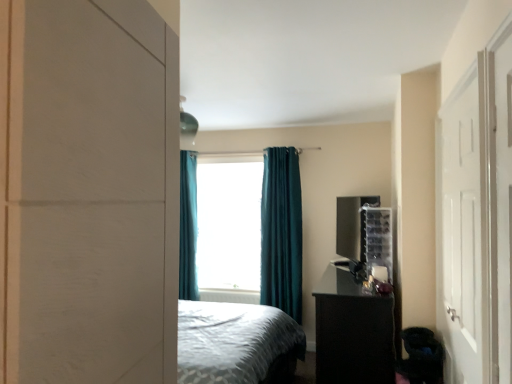
Image resolution: width=512 pixels, height=384 pixels. Describe the element at coordinates (353, 331) in the screenshot. I see `black glossy nightstand at lower right` at that location.

What do you see at coordinates (463, 229) in the screenshot?
I see `white matte door at right` at bounding box center [463, 229].

This screenshot has width=512, height=384. In order to click on teal fabric curtain at center, placed as the first curtain when sorted from front to back in this screenshot , I will do `click(281, 232)`.

What is the approximate width of clear plastic organizer at right?

It is 29.12 centimeters.

The height and width of the screenshot is (384, 512). Describe the element at coordinates (229, 223) in the screenshot. I see `teal curtain at center` at that location.

The image size is (512, 384). I want to click on teal fabric curtain at left, the 1th curtain viewed from the back, so click(x=188, y=226).

At what (x,y) coordinates should I click in order to perform the action: click on black glossy nightstand at lower right. Please return your answer as a coordinate pair (x, y). The height and width of the screenshot is (384, 512). Looking at the image, I should click on (353, 331).

This screenshot has height=384, width=512. Identify the location of nightstand above the white plastic radiator at center (from the image's perspective). point(353,331).

From a real-world perspective, which object stands above the other?

white plastic radiator at center is physically above.

From the picture: From the image's perspective, who appears lower, black glossy nightstand at lower right or white plastic radiator at center?

white plastic radiator at center appears lower in the image.

Consider the image. Is black glossy nightstand at lower right next to white plastic radiator at center and touching it?

No.

From a real-world perspective, which object stands above the other?

white plastic radiator at center, from a real-world perspective.

Consider the image. Considering the relative sizes of white plastic radiator at center and black glossy nightstand at lower right in the image provided, is white plastic radiator at center wider than black glossy nightstand at lower right?

No.

Which is more to the left, white plastic radiator at center or black glossy nightstand at lower right?

Positioned to the left is white plastic radiator at center.

Which of these two, white plastic radiator at center or black glossy nightstand at lower right, is smaller?

white plastic radiator at center.

Considering the sizes of teal fabric curtain at left, the 1th curtain viewed from the back, and white matte door at right in the image, is teal fabric curtain at left, the 1th curtain viewed from the back, wider or thinner than white matte door at right?

Considering their sizes, teal fabric curtain at left, the 1th curtain viewed from the back, looks broader than white matte door at right.

Is teal fabric curtain at left, positioned as the second curtain in right-to-left order, shorter than white matte door at right?

No, teal fabric curtain at left, positioned as the second curtain in right-to-left order, is not shorter than white matte door at right.

Could you tell me if teal fabric curtain at left, the 1th curtain viewed from the back, is turned towards white matte door at right?

No, teal fabric curtain at left, the 1th curtain viewed from the back, does not turn towards white matte door at right.

Is teal fabric curtain at center, placed as the first curtain when sorted from front to back, wider than teal fabric curtain at left, which ranks as the first curtain in left-to-right order?

Yes.

Considering the relative positions of teal fabric curtain at center, the second curtain when ordered from back to front, and teal fabric curtain at left, positioned as the second curtain in right-to-left order, in the image provided, is teal fabric curtain at center, the second curtain when ordered from back to front, to the right of teal fabric curtain at left, positioned as the second curtain in right-to-left order, from the viewer's perspective?

Yes, teal fabric curtain at center, the second curtain when ordered from back to front, is to the right of teal fabric curtain at left, positioned as the second curtain in right-to-left order.

Is teal fabric curtain at center, arranged as the 2th curtain when viewed from the left, smaller than teal fabric curtain at left, the 2th curtain when ordered from front to back?

Actually, teal fabric curtain at center, arranged as the 2th curtain when viewed from the left, might be larger than teal fabric curtain at left, the 2th curtain when ordered from front to back.

From a real-world perspective, is teal fabric curtain at center, placed as the first curtain when sorted from front to back, below teal fabric curtain at left, the 2th curtain when ordered from front to back?

Yes, from a real-world perspective, teal fabric curtain at center, placed as the first curtain when sorted from front to back, is beneath teal fabric curtain at left, the 2th curtain when ordered from front to back.

How far apart are white plastic radiator at center and teal fabric curtain at left, positioned as the second curtain in right-to-left order?

The distance of white plastic radiator at center from teal fabric curtain at left, positioned as the second curtain in right-to-left order, is 23.90 inches.

Are white plastic radiator at center and teal fabric curtain at left, which ranks as the first curtain in left-to-right order, located far from each other?

No, there isn't a large distance between white plastic radiator at center and teal fabric curtain at left, which ranks as the first curtain in left-to-right order.

Which is more to the right, white plastic radiator at center or teal fabric curtain at left, positioned as the second curtain in right-to-left order?

white plastic radiator at center.

What's the angular difference between white plastic radiator at center and teal fabric curtain at left, the 2th curtain when ordered from front to back,'s facing directions?

2.64 degrees separate the facing orientations of white plastic radiator at center and teal fabric curtain at left, the 2th curtain when ordered from front to back.

From the image's perspective, which is above, white matte door at right or clear plastic organizer at right?

white matte door at right is shown above in the image.

Considering the relative sizes of white matte door at right and clear plastic organizer at right in the image provided, is white matte door at right thinner than clear plastic organizer at right?

Yes, white matte door at right is thinner than clear plastic organizer at right.

Is white matte door at right bigger than clear plastic organizer at right?

Yes, white matte door at right is bigger than clear plastic organizer at right.

Is point (210, 297) positioned in front of point (373, 249)?

No, it is not.

Is white plastic radiator at center inside the boundaries of clear plastic organizer at right, or outside?

white plastic radiator at center is spatially situated outside clear plastic organizer at right.

What's the angular difference between white plastic radiator at center and clear plastic organizer at right's facing directions?

There is a 88.2-degree angle between the facing directions of white plastic radiator at center and clear plastic organizer at right.

At what (x,y) coordinates should I click in order to perform the action: click on radiator lying below the black glossy nightstand at lower right (from the image's perspective). Please return your answer as a coordinate pair (x, y). Image resolution: width=512 pixels, height=384 pixels. Looking at the image, I should click on (230, 296).

The image size is (512, 384). What are the coordinates of `nightstand on the right of the white plastic radiator at center` in the screenshot? It's located at (353, 331).

Considering their positions, is teal curtain at center positioned further to white plastic radiator at center than teal fabric curtain at center, the second curtain when ordered from back to front?

teal fabric curtain at center, the second curtain when ordered from back to front, is further to white plastic radiator at center.

Consider the image. Based on their spatial positions, is white matte door at right or black glossy nightstand at lower right further from clear plastic organizer at right?

white matte door at right is positioned further to the anchor clear plastic organizer at right.

Looking at the image, which one is located further to white plastic radiator at center, clear plastic organizer at right or black glossy nightstand at lower right?

black glossy nightstand at lower right is positioned further to the anchor white plastic radiator at center.

From the picture: Which object lies further to the anchor point teal fabric curtain at left, positioned as the second curtain in right-to-left order, white plastic radiator at center or white matte door at right?

white matte door at right is further to teal fabric curtain at left, positioned as the second curtain in right-to-left order.

From the image, which object appears to be nearer to white matte door at right, teal fabric curtain at left, the 1th curtain viewed from the back, or clear plastic organizer at right?

Based on the image, clear plastic organizer at right appears to be nearer to white matte door at right.

In the scene shown: Considering their positions, is clear plastic organizer at right positioned closer to teal curtain at center than black glossy nightstand at lower right?

Among the two, clear plastic organizer at right is located nearer to teal curtain at center.

Estimate the real-world distances between objects in this image. Which object is closer to teal fabric curtain at left, the 2th curtain when ordered from front to back, teal curtain at center or clear plastic organizer at right?

Among the two, teal curtain at center is located nearer to teal fabric curtain at left, the 2th curtain when ordered from front to back.

Looking at the image, which one is located further to black glossy nightstand at lower right, white plastic radiator at center or clear plastic organizer at right?

The object further to black glossy nightstand at lower right is white plastic radiator at center.

The image size is (512, 384). In order to click on curtain between clear plastic organizer at right and teal fabric curtain at left, the 1th curtain viewed from the back, in the front-back direction in this screenshot , I will do `click(281, 232)`.

This screenshot has height=384, width=512. I want to click on radiator situated between teal fabric curtain at left, the 2th curtain when ordered from front to back, and teal fabric curtain at center, arranged as the 2th curtain when viewed from the left, from left to right, so click(230, 296).

Locate an element on the screen. radiator between clear plastic organizer at right and teal fabric curtain at left, positioned as the second curtain in right-to-left order, in the front-back direction is located at coordinates (230, 296).

Where is `nightstand located between white matte door at right and teal curtain at center in the depth direction`? nightstand located between white matte door at right and teal curtain at center in the depth direction is located at coordinates (353, 331).